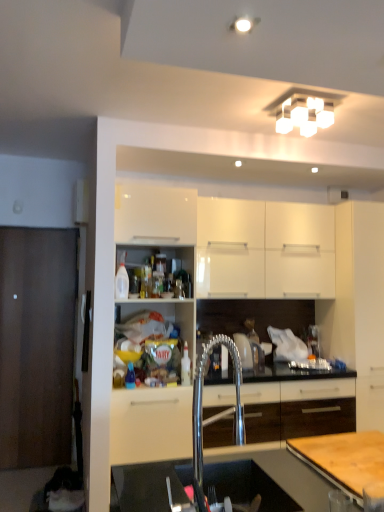
Question: Is translucent plastic bottle at center, marked as the first bottle in a back-to-front arrangement, bigger than white square light fixture at upper center?

Choices:
 (A) no
 (B) yes

Answer: (A)

Question: Considering the relative positions of translucent plastic bottle at center, which ranks as the second bottle in left-to-right order, and white square light fixture at upper center in the image provided, is translucent plastic bottle at center, which ranks as the second bottle in left-to-right order, to the left of white square light fixture at upper center from the viewer's perspective?

Choices:
 (A) yes
 (B) no

Answer: (A)

Question: Is translucent plastic bottle at center, the 1th bottle positioned from the right, completely or partially outside of white square light fixture at upper center?

Choices:
 (A) yes
 (B) no

Answer: (A)

Question: Can you confirm if translucent plastic bottle at center, the 1th bottle positioned from the right, is smaller than white square light fixture at upper center?

Choices:
 (A) yes
 (B) no

Answer: (A)

Question: Does translucent plastic bottle at center, marked as the first bottle in a back-to-front arrangement, appear on the right side of white square light fixture at upper center?

Choices:
 (A) yes
 (B) no

Answer: (B)

Question: Is translucent plastic bottle at center, marked as the first bottle in a back-to-front arrangement, bigger or smaller than translucent plastic bottle at shelf center, positioned as the first bottle in front-to-back order?

Choices:
 (A) small
 (B) big

Answer: (B)

Question: Is point (187, 364) closer or farther from the camera than point (134, 381)?

Choices:
 (A) farther
 (B) closer

Answer: (A)

Question: Which is correct: translucent plastic bottle at center, which ranks as the second bottle in left-to-right order, is inside translucent plastic bottle at shelf center, positioned as the first bottle in front-to-back order, or outside of it?

Choices:
 (A) outside
 (B) inside

Answer: (A)

Question: Considering their positions, is translucent plastic bottle at center, the 1th bottle positioned from the right, located in front of or behind translucent plastic bottle at shelf center, positioned as the first bottle in front-to-back order?

Choices:
 (A) behind
 (B) front

Answer: (A)

Question: Is white square light fixture at upper center in front of or behind white matte cabinet at right, marked as the 1th cabinetry in a right-to-left arrangement, in the image?

Choices:
 (A) front
 (B) behind

Answer: (A)

Question: Is white square light fixture at upper center wider or thinner than white matte cabinet at right, marked as the 1th cabinetry in a right-to-left arrangement?

Choices:
 (A) wide
 (B) thin

Answer: (B)

Question: Would you say white square light fixture at upper center is to the left or to the right of white matte cabinet at right, marked as the 1th cabinetry in a right-to-left arrangement, in the picture?

Choices:
 (A) right
 (B) left

Answer: (B)

Question: From the image's perspective, is white square light fixture at upper center positioned above or below white matte cabinet at right, which ranks as the 2th cabinetry in left-to-right order?

Choices:
 (A) below
 (B) above

Answer: (B)

Question: From a real-world perspective, is translucent plastic bottle at shelf center, the second bottle in the right-to-left sequence, above or below white matte cabinet at right, marked as the 1th cabinetry in a right-to-left arrangement?

Choices:
 (A) above
 (B) below

Answer: (B)

Question: From the image's perspective, is translucent plastic bottle at shelf center, positioned as the first bottle in front-to-back order, located above or below white matte cabinet at right, which ranks as the 2th cabinetry in left-to-right order?

Choices:
 (A) below
 (B) above

Answer: (A)